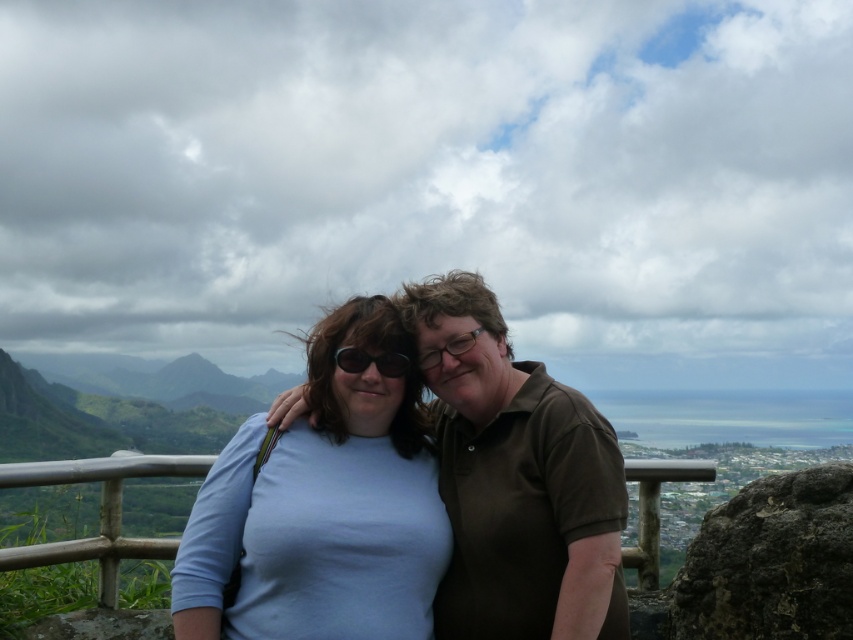
You are a photographer trying to capture a photo of the brown matte shirt at center and the silver metallic rail at center. Since you want both subjects to be in focus, which one should you focus on first to ensure the other is also sharp?

You should focus on the brown matte shirt at center first because it is closer to the viewer than the silver metallic rail at center, so focusing on the closer object will help keep both in focus.

Looking at this image, you are a photographer trying to capture a photo of the brown matte shirt at center and the silver metallic rail at center. Which object should you focus on first if you want to ensure both are in focus without adjusting the camera settings?

The brown matte shirt at center is not as tall as the silver metallic rail at center, so you should focus on the silver metallic rail at center first to ensure both are in focus.